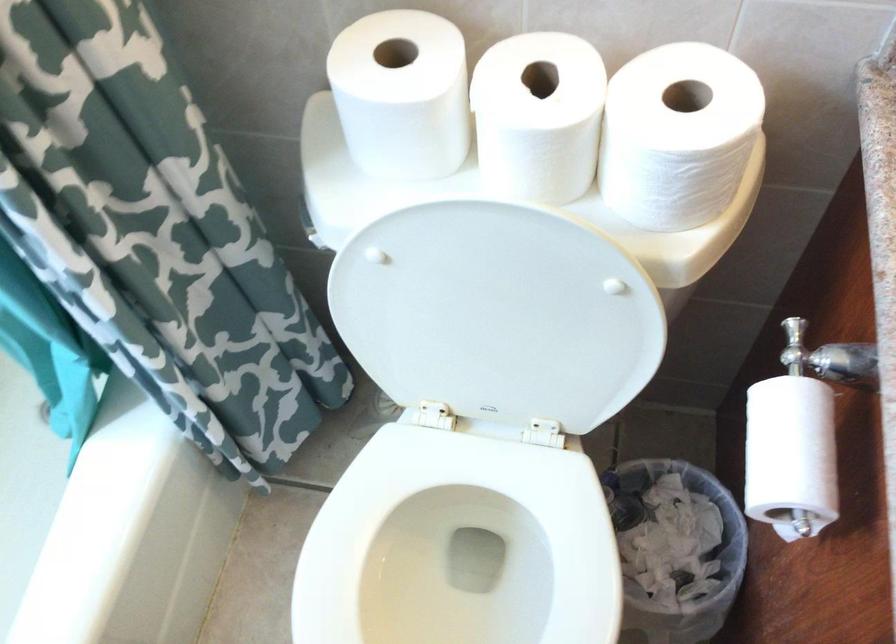
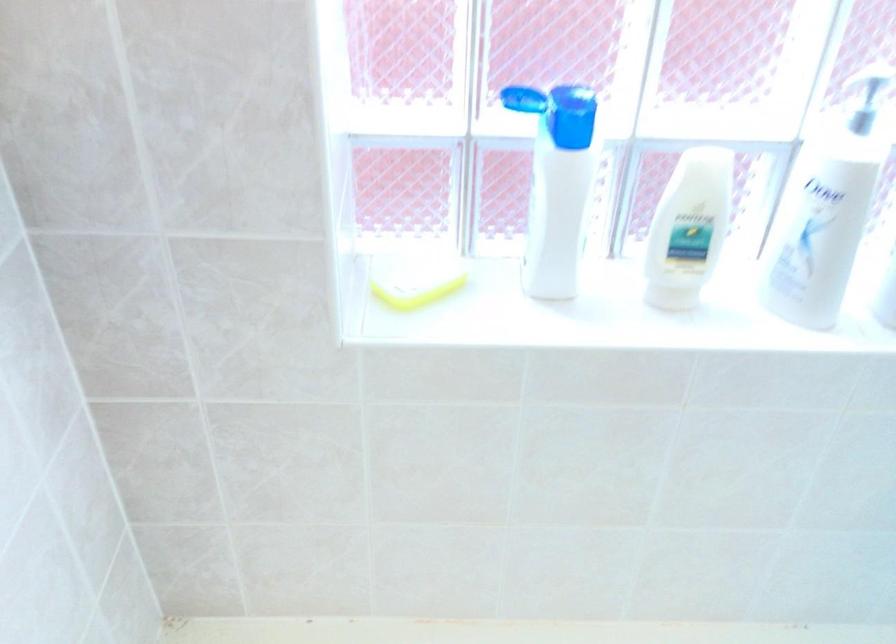
Question: The camera is either moving clockwise (left) or counter-clockwise (right) around the object. The first image is from the beginning of the video and the second image is from the end. Is the camera moving left or right when shooting the video?

Choices:
 (A) Left
 (B) Right

Answer: (B)